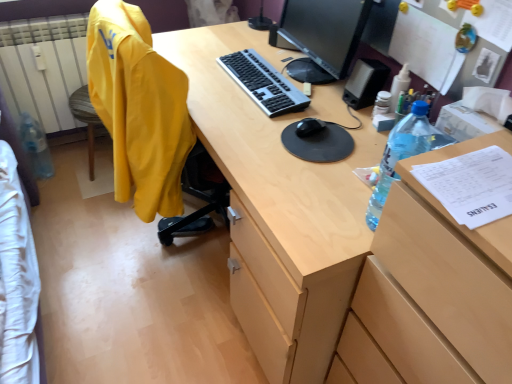
Where is `free spot in front of black glossy monitor at upper center`? free spot in front of black glossy monitor at upper center is located at coordinates (307, 112).